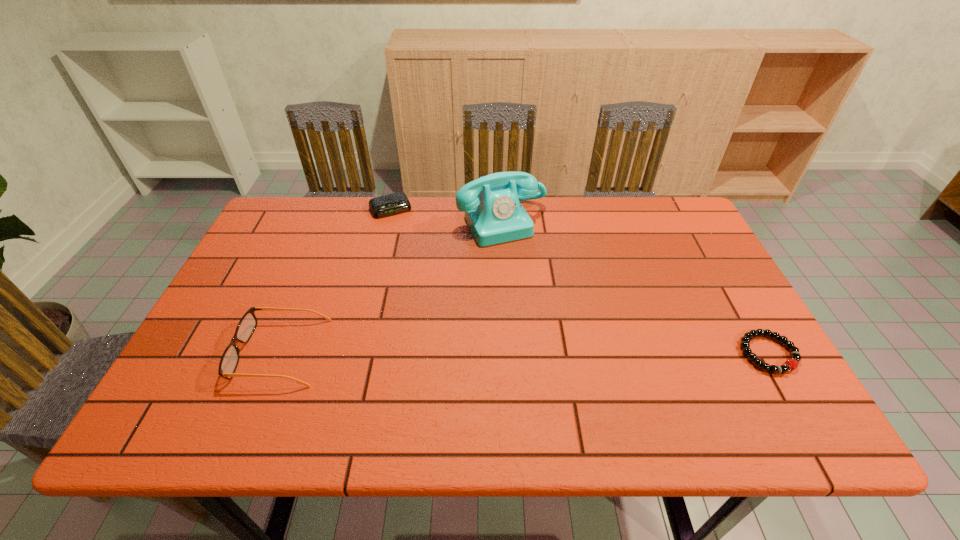
In the image, there is a desktop. At what (x,y) coordinates should I click in order to perform the action: click on vacant space at the far right corner. Please return your answer as a coordinate pair (x, y). This screenshot has height=540, width=960. Looking at the image, I should click on (642, 216).

Locate an element on the screen. vacant space that is in between the third object from left to right and the third shortest object is located at coordinates click(x=392, y=287).

At what (x,y) coordinates should I click in order to perform the action: click on free space between the rightmost object and the spectacles. Please return your answer as a coordinate pair (x, y). This screenshot has width=960, height=540. Looking at the image, I should click on (524, 353).

At what (x,y) coordinates should I click in order to perform the action: click on free space between the telephone and the leftmost object. Please return your answer as a coordinate pair (x, y). This screenshot has width=960, height=540. Looking at the image, I should click on (392, 287).

Where is `vacant region between the shortest object and the third shortest object`? The height and width of the screenshot is (540, 960). vacant region between the shortest object and the third shortest object is located at coordinates (524, 353).

Image resolution: width=960 pixels, height=540 pixels. Find the location of `vacant space that's between the third object from right to left and the leftmost object`. vacant space that's between the third object from right to left and the leftmost object is located at coordinates (335, 280).

Identify the location of empty space between the second shortest object and the rightmost object. (579, 281).

Identify the location of free space between the alarm clock and the shortest object. Image resolution: width=960 pixels, height=540 pixels. (579, 281).

Where is `free space between the tallest object and the third object from right to left`? free space between the tallest object and the third object from right to left is located at coordinates (446, 215).

What are the coordinates of `unoccupied area between the leftmost object and the rightmost object` in the screenshot? It's located at (524, 353).